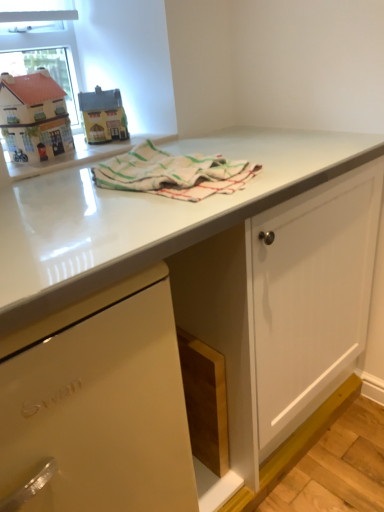
This screenshot has width=384, height=512. I want to click on vacant area that is situated to the right of matte plastic toy house at upper left, so click(x=144, y=136).